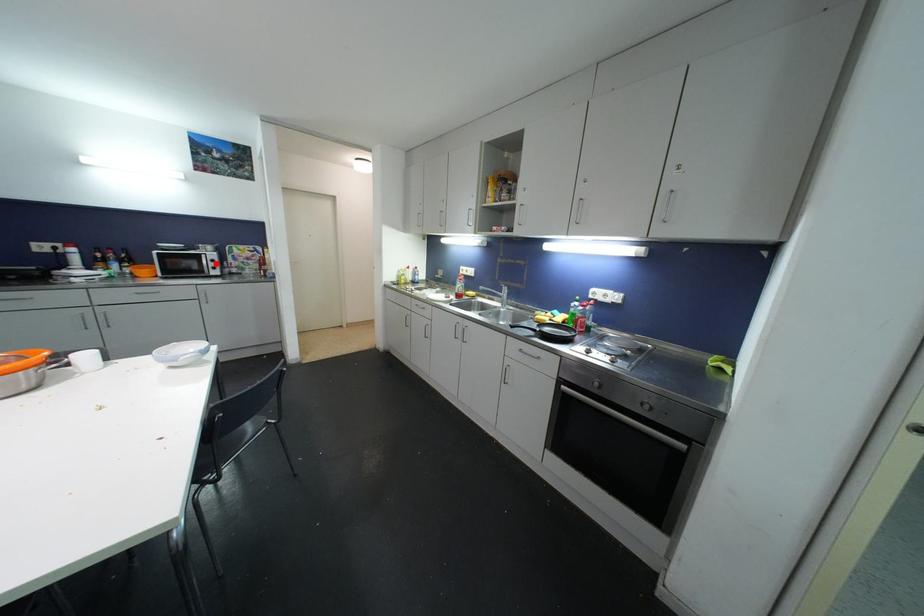
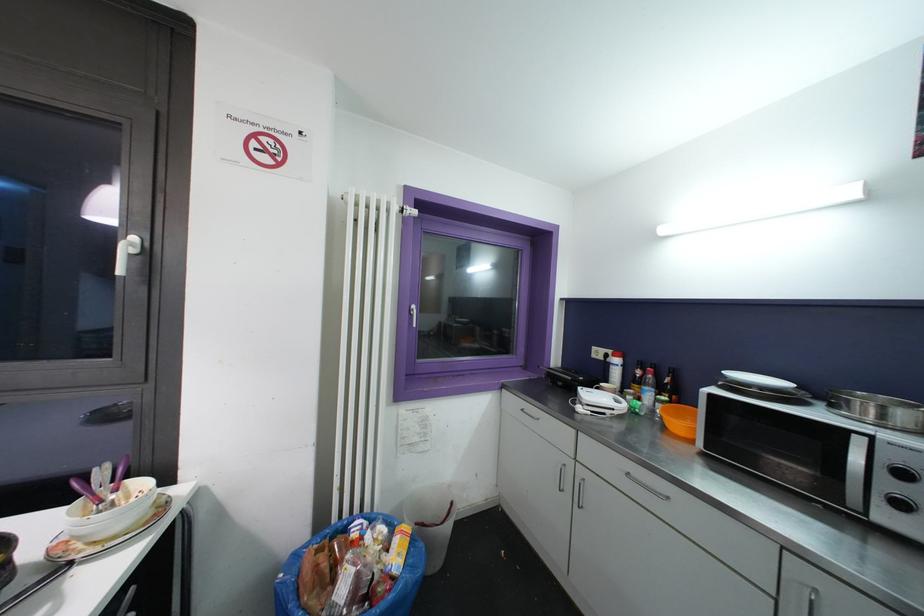
Where in the second image is the point corresponding to the highlighted location from the first image?

(906, 477)